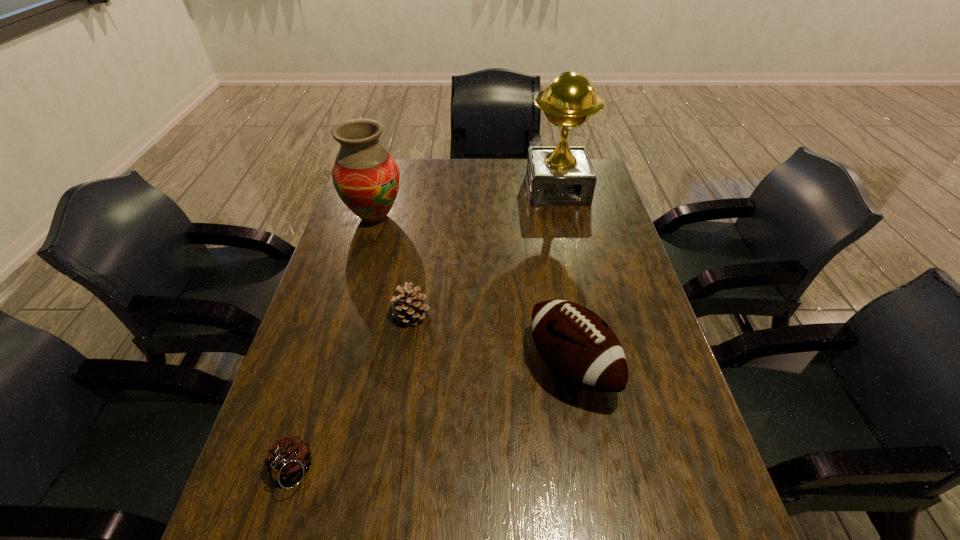
Where is `the tallest object`? The height and width of the screenshot is (540, 960). the tallest object is located at coordinates (562, 175).

What are the coordinates of `vase` in the screenshot? It's located at (366, 178).

Locate an element on the screen. The width and height of the screenshot is (960, 540). football (American) is located at coordinates (580, 347).

The width and height of the screenshot is (960, 540). In order to click on the right pinecone in this screenshot , I will do `click(410, 309)`.

Locate an element on the screen. the third object from left to right is located at coordinates (410, 309).

Locate an element on the screen. the nearer pinecone is located at coordinates pyautogui.click(x=288, y=458).

Locate an element on the screen. This screenshot has width=960, height=540. the left pinecone is located at coordinates (288, 458).

Locate an element on the screen. The image size is (960, 540). vacant space located on the front-facing side of the tallest object is located at coordinates (571, 252).

I want to click on blank area located on the front of the fourth shortest object, so click(x=365, y=251).

Locate an element on the screen. The width and height of the screenshot is (960, 540). free region located 0.050m on the left of the football (American) is located at coordinates (510, 366).